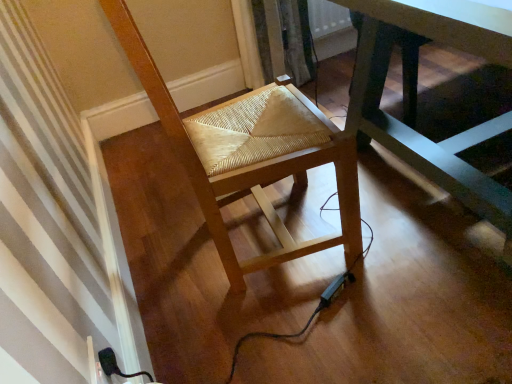
In order to click on dark green wooden table at center in this screenshot , I will do `click(416, 89)`.

Measure the distance between point (x=359, y=117) and camera.

5.30 feet.

What do you see at coordinates (416, 89) in the screenshot?
I see `dark green wooden table at center` at bounding box center [416, 89].

What do you see at coordinates (250, 154) in the screenshot?
I see `natural wood woven seat at center` at bounding box center [250, 154].

Find the location of a particular element. natural wood woven seat at center is located at coordinates (250, 154).

The height and width of the screenshot is (384, 512). Identify the location of dark green wooden table at center. (416, 89).

Visually, is dark green wooden table at center positioned to the left or to the right of natural wood woven seat at center?

dark green wooden table at center is to the right of natural wood woven seat at center.

Which object is more forward, dark green wooden table at center or natural wood woven seat at center?

dark green wooden table at center is more forward.

Which point is more forward, (457, 135) or (354, 149)?

The point (354, 149) is closer.

From the image's perspective, does dark green wooden table at center appear higher than natural wood woven seat at center?

Indeed, from the image's perspective, dark green wooden table at center is shown above natural wood woven seat at center.

From a real-world perspective, which is physically above, dark green wooden table at center or natural wood woven seat at center?

natural wood woven seat at center, from a real-world perspective.

Considering the sizes of objects dark green wooden table at center and natural wood woven seat at center in the image provided, who is wider, dark green wooden table at center or natural wood woven seat at center?

dark green wooden table at center is wider.

Does dark green wooden table at center have a lesser height compared to natural wood woven seat at center?

Yes.

Considering the relative sizes of dark green wooden table at center and natural wood woven seat at center in the image provided, is dark green wooden table at center smaller than natural wood woven seat at center?

Incorrect, dark green wooden table at center is not smaller in size than natural wood woven seat at center.

Would you say natural wood woven seat at center is part of dark green wooden table at center's contents?

No, natural wood woven seat at center is located outside of dark green wooden table at center.

Is dark green wooden table at center next to natural wood woven seat at center and touching it?

dark green wooden table at center and natural wood woven seat at center are not in contact.

Is natural wood woven seat at center at the back of dark green wooden table at center?

That's not correct — dark green wooden table at center is not looking away from natural wood woven seat at center.

Where is `table that appears on the right of natural wood woven seat at center`? table that appears on the right of natural wood woven seat at center is located at coordinates (416, 89).

Does natural wood woven seat at center appear on the right side of dark green wooden table at center?

In fact, natural wood woven seat at center is to the left of dark green wooden table at center.

Does natural wood woven seat at center come in front of dark green wooden table at center?

No.

Is point (252, 181) in front of point (374, 76)?

Yes, it is in front of point (374, 76).

From the image's perspective, is natural wood woven seat at center under dark green wooden table at center?

Indeed, from the image's perspective, natural wood woven seat at center is shown beneath dark green wooden table at center.

From a real-world perspective, between natural wood woven seat at center and dark green wooden table at center, who is vertically higher?

In real-world perspective, natural wood woven seat at center is above.

Is natural wood woven seat at center wider than dark green wooden table at center?

No.

From their relative heights in the image, would you say natural wood woven seat at center is taller or shorter than dark green wooden table at center?

Considering their sizes, natural wood woven seat at center has more height than dark green wooden table at center.

Which of these two, natural wood woven seat at center or dark green wooden table at center, is bigger?

dark green wooden table at center is bigger.

Would you say natural wood woven seat at center is inside or outside dark green wooden table at center?

natural wood woven seat at center is not inside dark green wooden table at center, it's outside.

Is there a large distance between natural wood woven seat at center and dark green wooden table at center?

natural wood woven seat at center is actually quite close to dark green wooden table at center.

Based on the photo, is natural wood woven seat at center oriented towards dark green wooden table at center?

Yes, natural wood woven seat at center is oriented towards dark green wooden table at center.

Can you tell me how much natural wood woven seat at center and dark green wooden table at center differ in facing direction?

The facing directions of natural wood woven seat at center and dark green wooden table at center are 86 degrees apart.

Where is `table that appears in front of the natural wood woven seat at center`? The height and width of the screenshot is (384, 512). table that appears in front of the natural wood woven seat at center is located at coordinates (416, 89).

Identify the location of table on the right side of natural wood woven seat at center. This screenshot has height=384, width=512. (416, 89).

Find the location of a particular element. The height and width of the screenshot is (384, 512). chair located on the left of dark green wooden table at center is located at coordinates (250, 154).